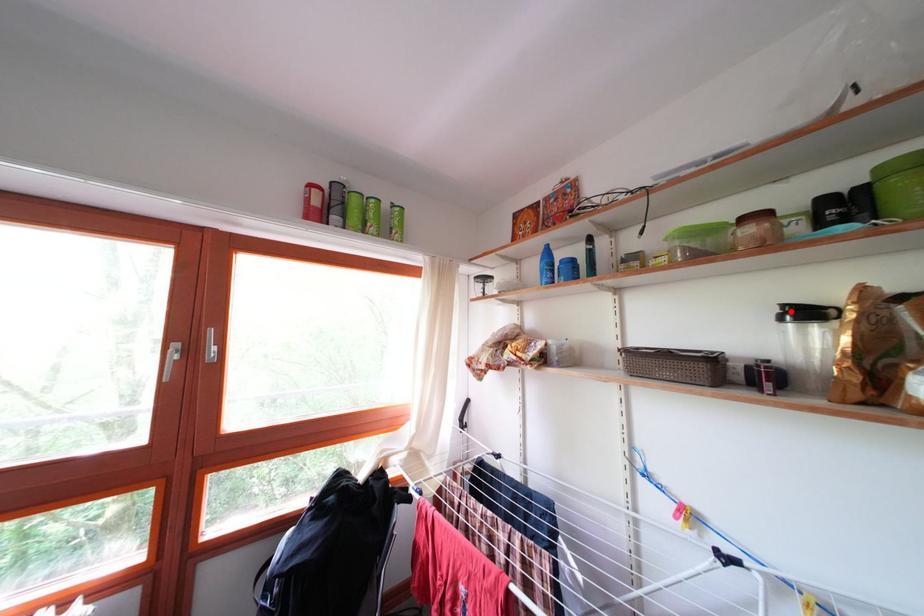
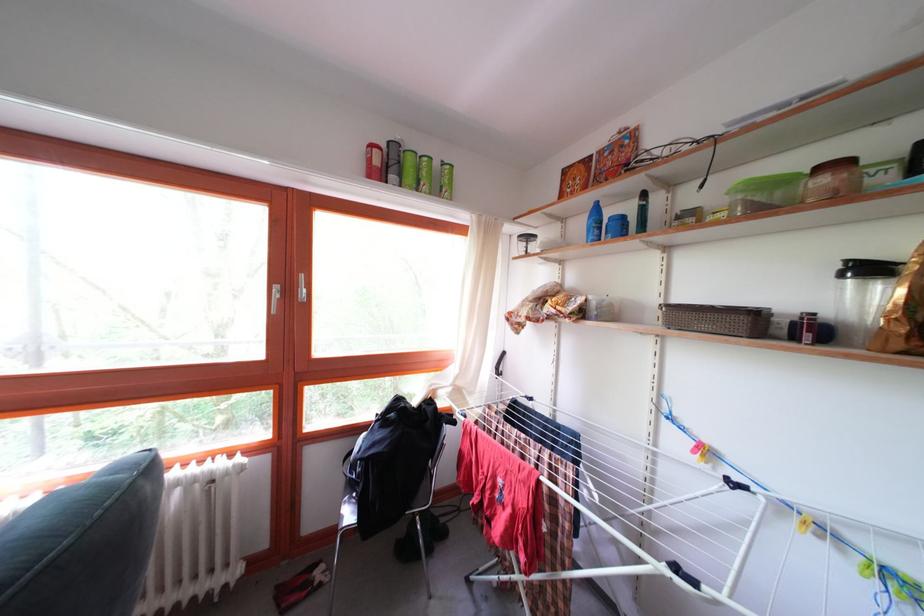
In the second image, find the point that corresponds to the highlighted location in the first image.

(855, 267)